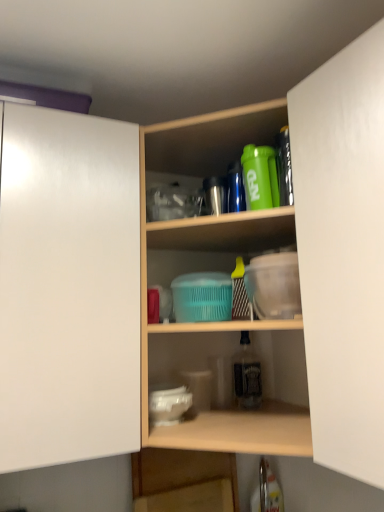
Question: From the image's perspective, is green matte shaker at upper center, placed as the 2th bottle when sorted from back to front, located above or below clear glass bottle at center, which is the 2th bottle from front to back?

Choices:
 (A) above
 (B) below

Answer: (A)

Question: Considering the positions of point (251, 179) and point (241, 351), is point (251, 179) closer or farther from the camera than point (241, 351)?

Choices:
 (A) farther
 (B) closer

Answer: (B)

Question: Which object is positioned closest to the green matte shaker at upper center, the 2th bottle when ordered from bottom to top?

Choices:
 (A) white matte cabinet door at left, positioned as the 1th cabinetry in left-to-right order
 (B) wooden shelf at lower center, the second shelf viewed from the top
 (C) wooden shelves at center, the first shelf viewed from the top
 (D) white matte cabinet door at right, acting as the second cabinetry starting from the left
 (E) clear glass bottle at center, which is counted as the first bottle, starting from the back

Answer: (D)

Question: Estimate the real-world distances between objects in this image. Which object is closer to the wooden shelves at center, the first shelf viewed from the top?

Choices:
 (A) white matte cabinet door at left, marked as the 2th cabinetry in a right-to-left arrangement
 (B) wooden shelf at lower center, the second shelf viewed from the top
 (C) white matte cabinet door at right, acting as the second cabinetry starting from the left
 (D) clear glass bottle at center, the 2th bottle viewed from the top
 (E) green matte shaker at upper center, the 2th bottle when ordered from bottom to top

Answer: (A)